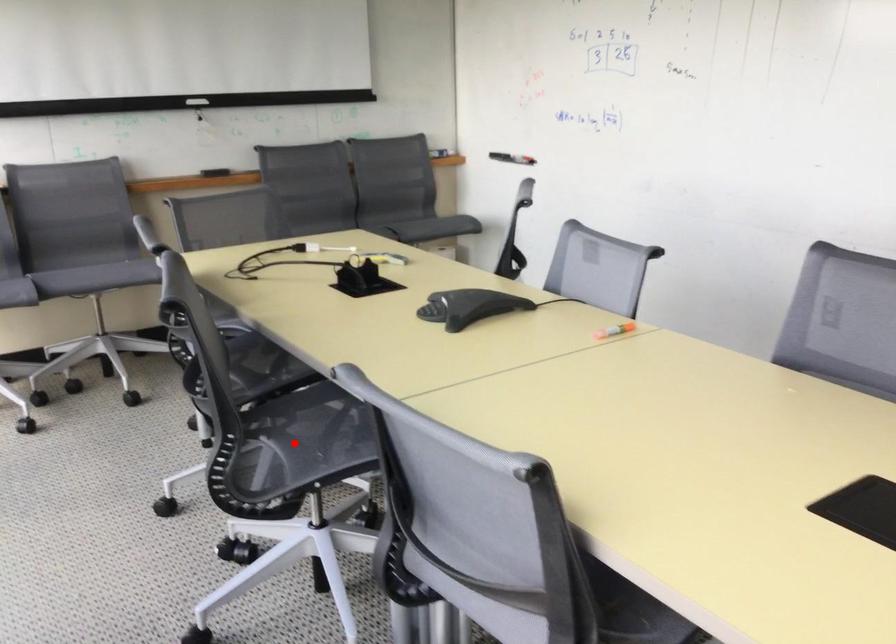
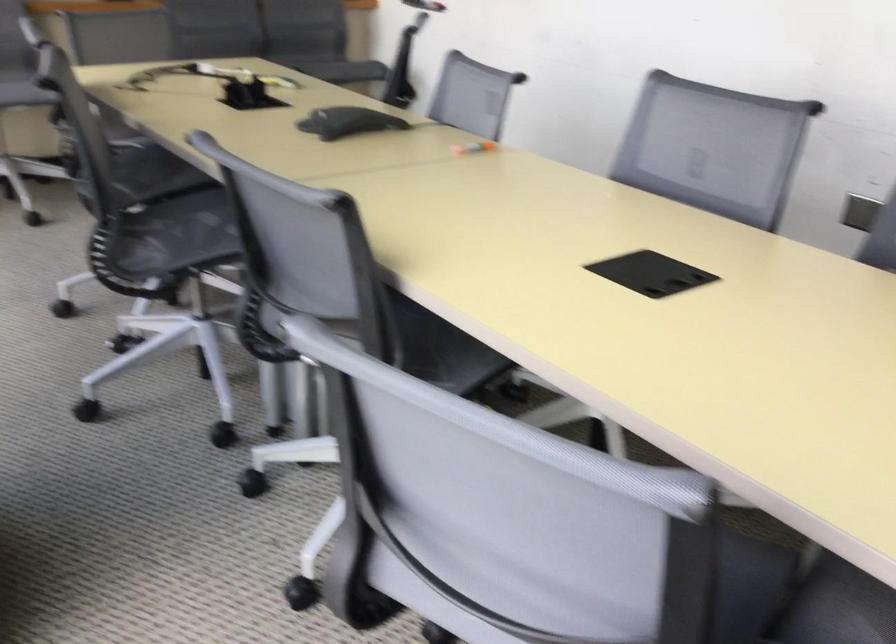
The point at the highlighted location is marked in the first image. Where is the corresponding point in the second image?

(176, 234)